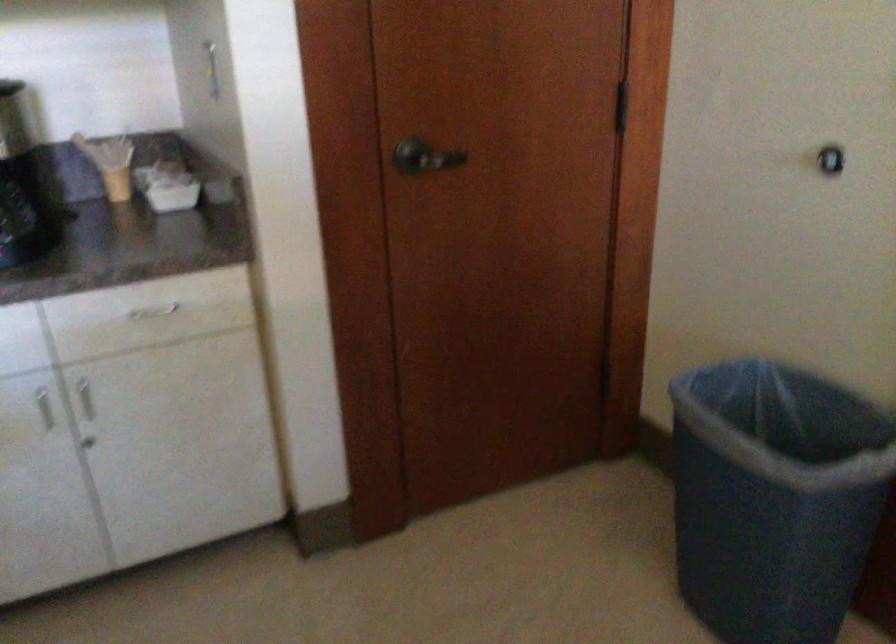
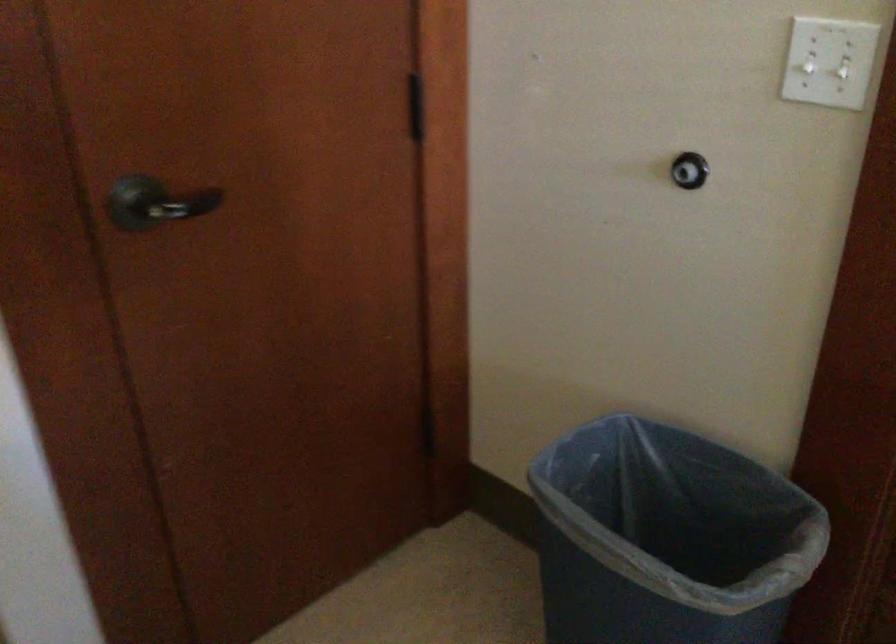
Question: Which direction would the cameraman need to move to produce the second image? Reply with the corresponding letter.

Choices:
 (A) Left
 (B) Right
 (C) Forward
 (D) Backward

Answer: (C)